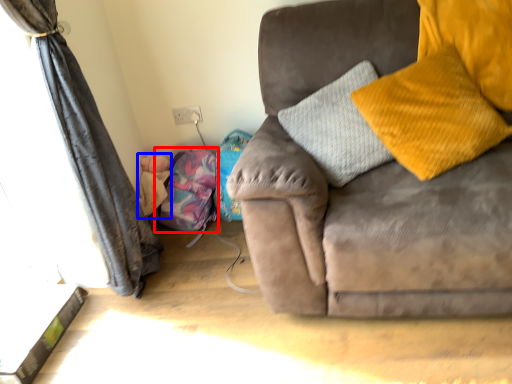
Question: Which object is further to the camera taking this photo, bean bag chair (highlighted by a red box) or baby (highlighted by a blue box)?

Choices:
 (A) bean bag chair
 (B) baby

Answer: (B)